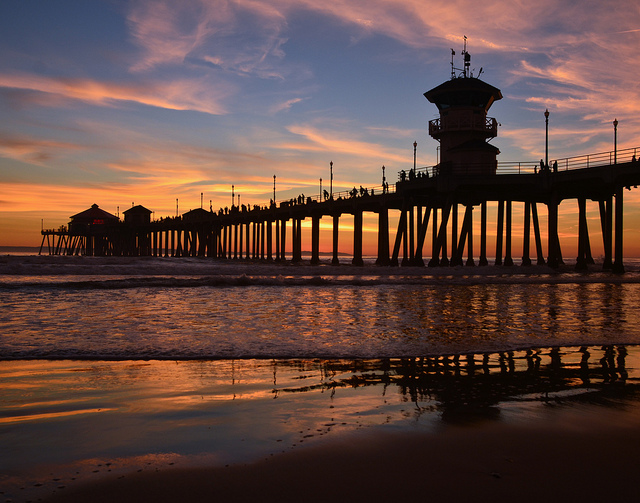
Where is `spiral staircase`? spiral staircase is located at coordinates (436, 132).